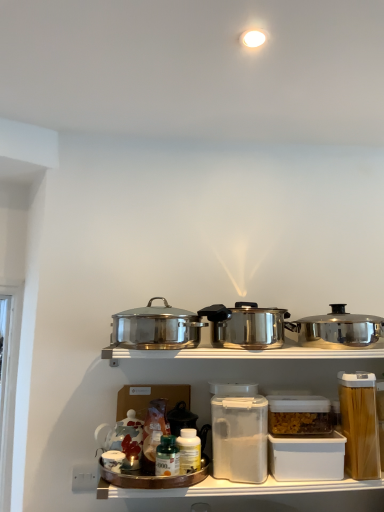
Question: From a real-world perspective, is white plastic container at lower center positioned above or below clear plastic container at center, the 2th appliance when ordered from left to right?

Choices:
 (A) above
 (B) below

Answer: (B)

Question: Considering the relative positions of white plastic container at lower center and clear plastic container at center, the 2th appliance when ordered from left to right, in the image provided, is white plastic container at lower center to the left or to the right of clear plastic container at center, the 2th appliance when ordered from left to right,?

Choices:
 (A) left
 (B) right

Answer: (A)

Question: Considering the real-world distances, which object is closest to the white plastic container at lower center?

Choices:
 (A) polished stainless steel pot at right, arranged as the 1th kitchen appliance when viewed from the right
 (B) polished stainless steel pot at center, placed as the first kitchen appliance when sorted from left to right
 (C) white plastic bottle at center, the second bottle in the left-to-right sequence
 (D) green glass bottle at center, positioned as the second bottle in right-to-left order
 (E) clear plastic container at center, the 2th appliance when ordered from left to right

Answer: (E)

Question: Considering the real-world distances, which object is closest to the green glass bottle at center, the first bottle from the left?

Choices:
 (A) polished stainless steel pot at center, arranged as the third kitchen appliance when viewed from the right
 (B) polished stainless steel pot at right, arranged as the 1th kitchen appliance when viewed from the right
 (C) clear plastic container at center, the 2th appliance when ordered from left to right
 (D) clear plastic container at lower right, placed as the 1th appliance when sorted from right to left
 (E) white plastic container at lower center

Answer: (A)